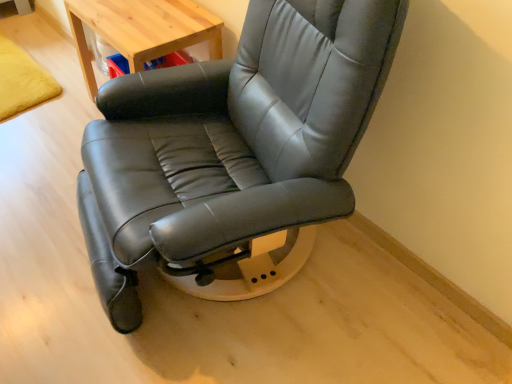
Question: Is black leather chair at center taller or shorter than light wood table at upper left?

Choices:
 (A) short
 (B) tall

Answer: (B)

Question: Is black leather chair at center inside the boundaries of light wood table at upper left, or outside?

Choices:
 (A) inside
 (B) outside

Answer: (B)

Question: From the image's perspective, is black leather chair at center above or below light wood table at upper left?

Choices:
 (A) above
 (B) below

Answer: (B)

Question: From a real-world perspective, relative to black leather chair at center, is light wood table at upper left vertically above or below?

Choices:
 (A) above
 (B) below

Answer: (B)

Question: Is light wood table at upper left bigger or smaller than black leather chair at center?

Choices:
 (A) small
 (B) big

Answer: (A)

Question: Is point (72, 31) positioned closer to the camera than point (228, 241)?

Choices:
 (A) farther
 (B) closer

Answer: (A)

Question: From the image's perspective, relative to black leather chair at center, is light wood table at upper left above or below?

Choices:
 (A) below
 (B) above

Answer: (B)